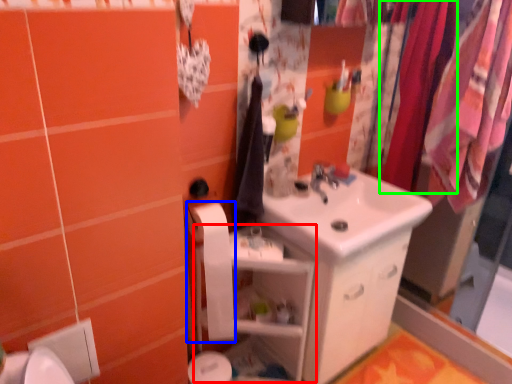
Question: Based on their relative distances, which object is nearer to shelf (highlighted by a red box)? Choose from toilet paper (highlighted by a blue box) and clothesline (highlighted by a green box).

Choices:
 (A) toilet paper
 (B) clothesline

Answer: (A)